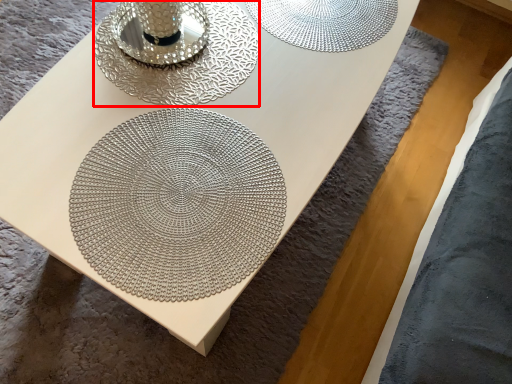
Question: From the image's perspective, what is the correct spatial relationship of candle holder (annotated by the red box) in relation to mandala?

Choices:
 (A) above
 (B) below

Answer: (A)